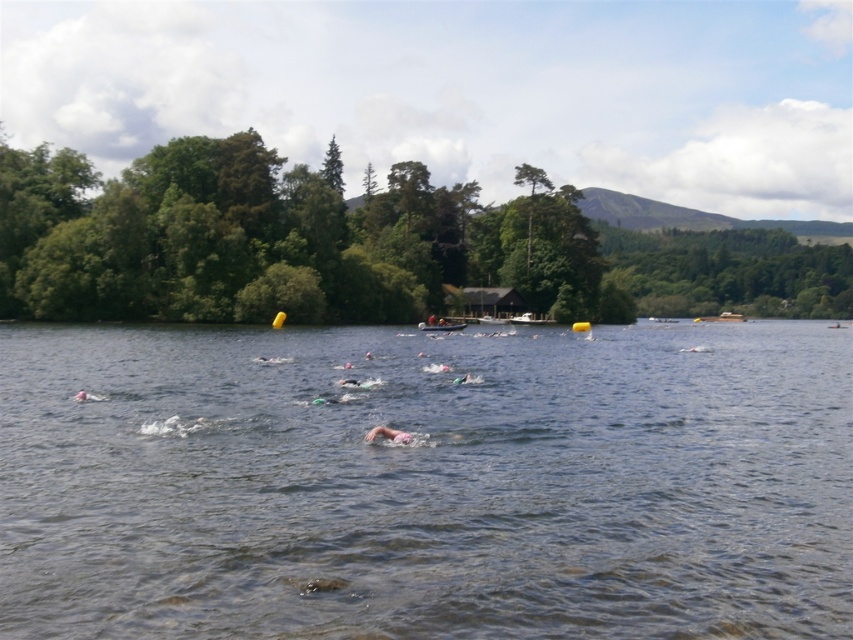
You are a swimmer participating in a triathlon and see the clear water at center and the white plastic boat at center. Which object takes up more space in the image?

The clear water at center is larger in size than the white plastic boat at center, so it takes up more space in the image.

You are a participant in a triathlon swimming event. You notice a pink swim cap at center and a white plastic boat at center. Which object is closer to the water surface?

The pink swim cap at center is below the white plastic boat at center, so the white plastic boat at center is closer to the water surface.

From the picture: You are a swimmer participating in a triathlon and notice two objects in the water ahead of you. One is the clear water at center and the other is the pink swim cap at center. Which object is positioned to the right when looking forward?

The clear water at center is to the right of the pink swim cap at center.